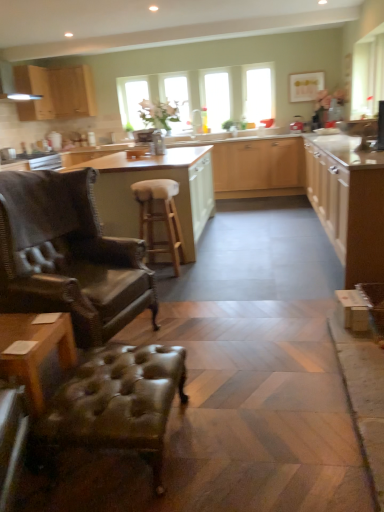
Question: In the image, is matte wood cabinet at right, positioned as the fourth cabinetry in left-to-right order, on the left side or the right side of wooden stool at center?

Choices:
 (A) right
 (B) left

Answer: (A)

Question: Looking at the image, does matte wood cabinet at right, the first cabinetry when ordered from right to left, seem bigger or smaller compared to wooden stool at center?

Choices:
 (A) big
 (B) small

Answer: (A)

Question: Which of these objects is positioned closest to the matte wood cabinet at upper left, acting as the 1th cabinetry starting from the left?

Choices:
 (A) leather wingback chair at left
 (B) matte wood cabinetry at center, which is the second cabinetry from right to left
 (C) wooden stool at center
 (D) clear glass window at center, the 2th window screen positioned from the right
 (E) wooden table at lower left

Answer: (D)

Question: Considering the real-world distances, which object is farthest from the leather tufted ottoman at lower left?

Choices:
 (A) clear glass window at center, positioned as the 1th window screen in left-to-right order
 (B) matte wood cabinetry at center, which ranks as the 3th cabinetry in left-to-right order
 (C) transparent glass window at center, which is the 2th window screen in left-to-right order
 (D) wooden table at lower left
 (E) leather wingback chair at left

Answer: (C)